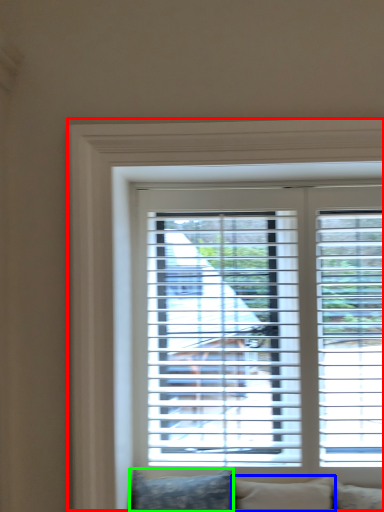
Question: Which object is positioned closest to window (highlighted by a red box)? Select from pillow (highlighted by a blue box) and pillow (highlighted by a green box).

Choices:
 (A) pillow
 (B) pillow

Answer: (B)